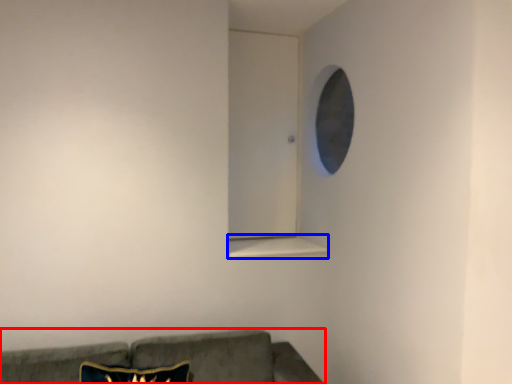
Question: Which point is closer to the camera, studio couch (highlighted by a red box) or window sill (highlighted by a blue box)?

Choices:
 (A) studio couch
 (B) window sill

Answer: (A)